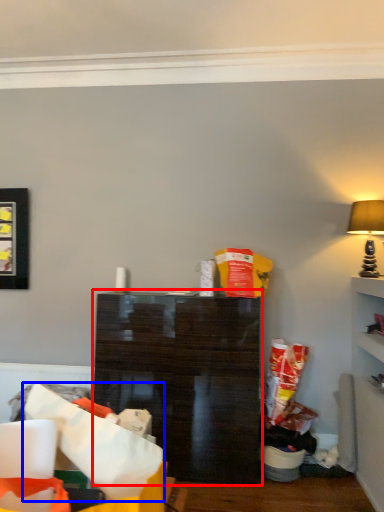
Question: Which object is closer to the camera taking this photo, shelf (highlighted by a red box) or paper bag (highlighted by a blue box)?

Choices:
 (A) shelf
 (B) paper bag

Answer: (B)